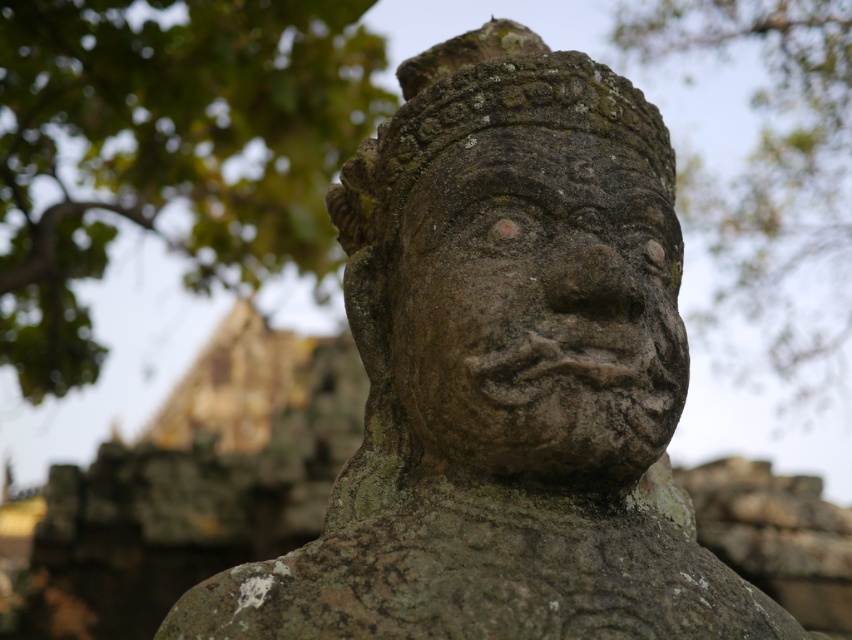
Question: Is rough stone face at center bigger than green mossy stone face at upper center?

Choices:
 (A) yes
 (B) no

Answer: (B)

Question: Does green mossy stone statue at upper center appear over rough stone face at center?

Choices:
 (A) yes
 (B) no

Answer: (A)

Question: Considering the real-world distances, which object is farthest from the green mossy stone face at upper center?

Choices:
 (A) rough stone face at center
 (B) green mossy stone statue at upper center

Answer: (A)

Question: Which point is closer to the camera taking this photo?

Choices:
 (A) (438, 193)
 (B) (695, 17)

Answer: (A)

Question: Which point is closer to the camera?

Choices:
 (A) green mossy stone face at upper center
 (B) green mossy stone statue at upper center

Answer: (B)

Question: In this image, where is green mossy stone statue at upper center located relative to rough stone face at center?

Choices:
 (A) below
 (B) above

Answer: (B)